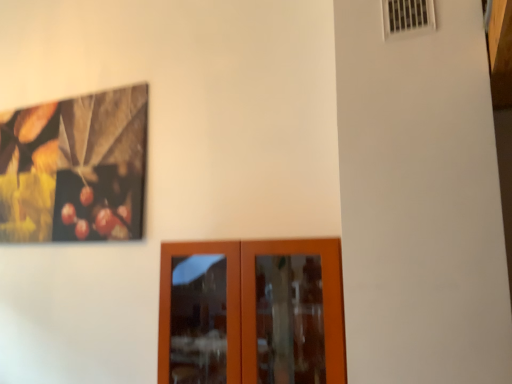
Question: In terms of height, does white plastic air conditioning at upper right look taller or shorter compared to brown wooden door at lower center?

Choices:
 (A) short
 (B) tall

Answer: (A)

Question: From the image's perspective, relative to brown wooden door at lower center, is white plastic air conditioning at upper right above or below?

Choices:
 (A) below
 (B) above

Answer: (B)

Question: Is white plastic air conditioning at upper right inside or outside of brown wooden door at lower center?

Choices:
 (A) outside
 (B) inside

Answer: (A)

Question: Would you say brown wooden door at lower center is inside or outside white plastic air conditioning at upper right?

Choices:
 (A) outside
 (B) inside

Answer: (A)

Question: Is brown wooden door at lower center wider or thinner than white plastic air conditioning at upper right?

Choices:
 (A) wide
 (B) thin

Answer: (A)

Question: Does point (243, 266) appear closer or farther from the camera than point (411, 23)?

Choices:
 (A) closer
 (B) farther

Answer: (B)

Question: In the image, is brown wooden door at lower center positioned in front of or behind white plastic air conditioning at upper right?

Choices:
 (A) front
 (B) behind

Answer: (B)